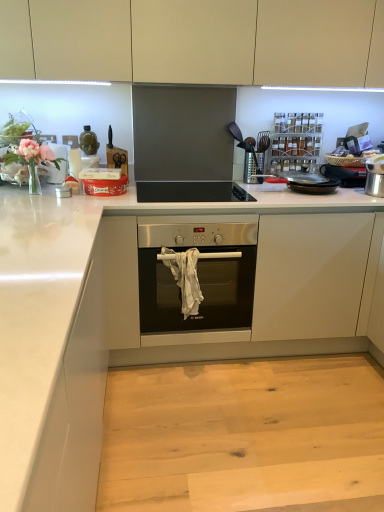
Question: Is black matte gas stove at upper center wider than white glossy countertop at center?

Choices:
 (A) no
 (B) yes

Answer: (A)

Question: Is black matte gas stove at upper center looking in the opposite direction of white glossy countertop at center?

Choices:
 (A) no
 (B) yes

Answer: (B)

Question: Is black matte gas stove at upper center not near white glossy countertop at center?

Choices:
 (A) no
 (B) yes

Answer: (A)

Question: Could you tell me if black matte gas stove at upper center is facing white glossy countertop at center?

Choices:
 (A) yes
 (B) no

Answer: (A)

Question: From a real-world perspective, is black matte gas stove at upper center on top of white glossy countertop at center?

Choices:
 (A) no
 (B) yes

Answer: (B)

Question: Relative to matte beige cabinets at upper center, is metallic spice rack at upper right in front or behind?

Choices:
 (A) behind
 (B) front

Answer: (A)

Question: Choose the correct answer: Is metallic spice rack at upper right inside matte beige cabinets at upper center or outside it?

Choices:
 (A) outside
 (B) inside

Answer: (A)

Question: In terms of height, does metallic spice rack at upper right look taller or shorter compared to matte beige cabinets at upper center?

Choices:
 (A) short
 (B) tall

Answer: (A)

Question: From a real-world perspective, relative to matte beige cabinets at upper center, is metallic spice rack at upper right vertically above or below?

Choices:
 (A) above
 (B) below

Answer: (B)

Question: In the image, is white glossy countertop at center positioned in front of or behind black matte gas stove at upper center?

Choices:
 (A) front
 (B) behind

Answer: (A)

Question: Looking at their shapes, would you say white glossy countertop at center is wider or thinner than black matte gas stove at upper center?

Choices:
 (A) wide
 (B) thin

Answer: (A)

Question: From their relative heights in the image, would you say white glossy countertop at center is taller or shorter than black matte gas stove at upper center?

Choices:
 (A) tall
 (B) short

Answer: (A)

Question: Considering the positions of white glossy countertop at center and black matte gas stove at upper center in the image, is white glossy countertop at center bigger or smaller than black matte gas stove at upper center?

Choices:
 (A) small
 (B) big

Answer: (B)

Question: In terms of height, does white glossy countertop at center look taller or shorter compared to metallic spice rack at upper right?

Choices:
 (A) short
 (B) tall

Answer: (B)

Question: From the image's perspective, relative to metallic spice rack at upper right, is white glossy countertop at center above or below?

Choices:
 (A) above
 (B) below

Answer: (B)